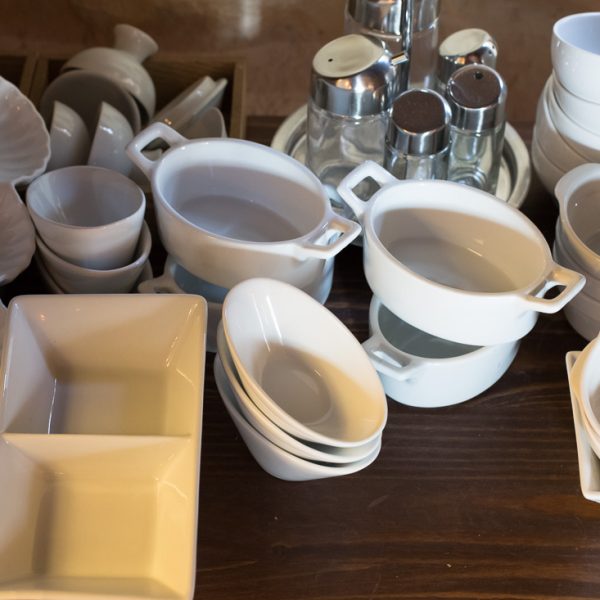
Locate an element on the screen. This screenshot has width=600, height=600. handles is located at coordinates (370, 166), (573, 288), (385, 373), (153, 127), (352, 235), (160, 283).